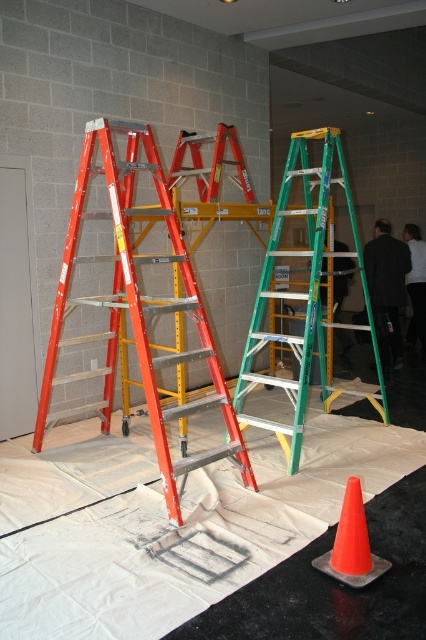
Is orange fiberglass ladder at left smaller than orange plastic traffic cone at lower right?

Incorrect, orange fiberglass ladder at left is not smaller in size than orange plastic traffic cone at lower right.

Can you confirm if orange fiberglass ladder at left is bigger than orange plastic traffic cone at lower right?

Yes, orange fiberglass ladder at left is bigger than orange plastic traffic cone at lower right.

The height and width of the screenshot is (640, 426). Describe the element at coordinates (137, 308) in the screenshot. I see `orange fiberglass ladder at left` at that location.

At what (x,y) coordinates should I click in order to perform the action: click on orange fiberglass ladder at left. Please return your answer as a coordinate pair (x, y). The height and width of the screenshot is (640, 426). Looking at the image, I should click on (137, 308).

Is green metallic ladder at center thinner than orange plastic traffic cone at lower right?

No, green metallic ladder at center is not thinner than orange plastic traffic cone at lower right.

What do you see at coordinates (302, 296) in the screenshot?
I see `green metallic ladder at center` at bounding box center [302, 296].

The height and width of the screenshot is (640, 426). Find the location of `green metallic ladder at center`. green metallic ladder at center is located at coordinates (302, 296).

Is orange fiberglass ladder at left below green metallic ladder at center?

Yes, orange fiberglass ladder at left is below green metallic ladder at center.

Looking at this image, is orange fiberglass ladder at left wider than green metallic ladder at center?

Indeed, orange fiberglass ladder at left has a greater width compared to green metallic ladder at center.

Which is behind, point (233, 445) or point (261, 374)?

The point (261, 374) is more distant.

What are the coordinates of `orange fiberglass ladder at left` in the screenshot? It's located at point(137,308).